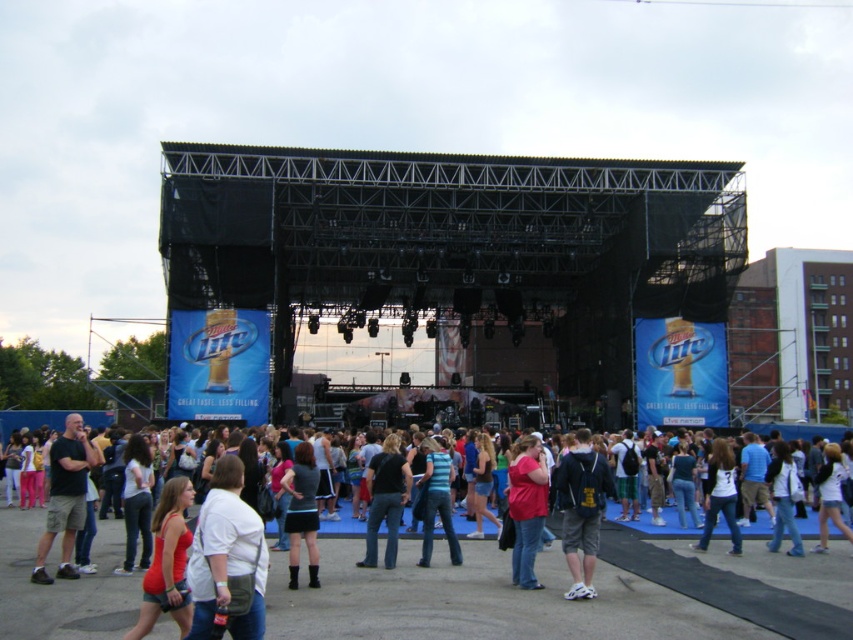
You are a photographer at the outdoor concert venue. You need to capture both the denim jacket at center and the denim jacket at lower right in a single shot. Which denim jacket should you focus on to ensure both are in frame without moving the camera?

The denim jacket at center is bigger than the denim jacket at lower right, so focusing on the denim jacket at center will ensure both are in frame without moving the camera.

You are an event organizer who needs to place a new banner between the dark gray backpack at center and the matte pink shirt at center. According to the scene description, which object should the banner be placed closer to?

The banner should be placed closer to the matte pink shirt at center because the dark gray backpack at center is to the right of the matte pink shirt at center, meaning the backpack is further to the right and the shirt is to the left. Therefore, placing the banner closer to the shirt would position it between them.